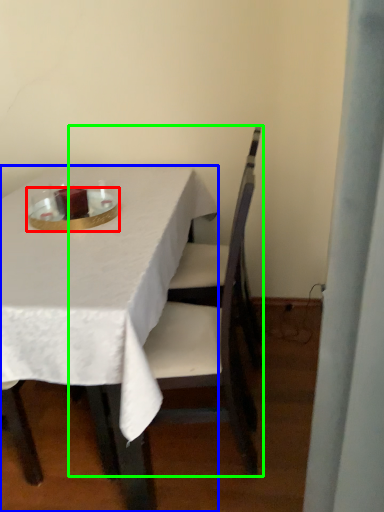
Question: Based on their relative distances, which object is nearer to tableware (highlighted by a red box)? Choose from table (highlighted by a blue box) and chair (highlighted by a green box).

Choices:
 (A) table
 (B) chair

Answer: (A)